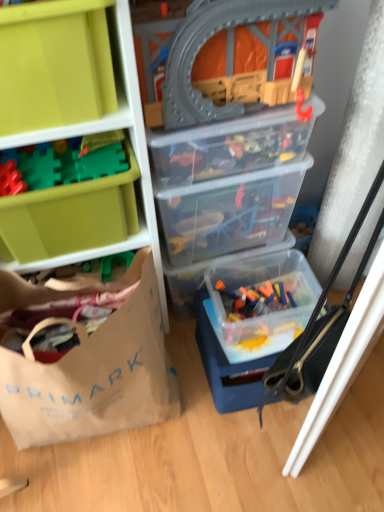
Question: Can you confirm if transparent plastic toy train set at center, the 3th storage box in the front-to-back sequence, is wider than translucent plastic container at center, which is the 1th storage box in back-to-front order?

Choices:
 (A) yes
 (B) no

Answer: (B)

Question: From a real-world perspective, is transparent plastic toy train set at center, the 3th storage box in the front-to-back sequence, positioned under translucent plastic container at center, which is the 1th storage box in back-to-front order, based on gravity?

Choices:
 (A) no
 (B) yes

Answer: (A)

Question: From the image's perspective, does transparent plastic toy train set at center, the 3th storage box in the front-to-back sequence, appear lower than translucent plastic container at center, acting as the sixth storage box starting from the front?

Choices:
 (A) yes
 (B) no

Answer: (B)

Question: From a real-world perspective, is transparent plastic toy train set at center, the 3th storage box in the front-to-back sequence, over translucent plastic container at center, which is the 1th storage box in back-to-front order?

Choices:
 (A) no
 (B) yes

Answer: (B)

Question: Is the depth of transparent plastic toy train set at center, the 3th storage box in the front-to-back sequence, greater than that of translucent plastic container at center, acting as the sixth storage box starting from the front?

Choices:
 (A) yes
 (B) no

Answer: (B)

Question: Based on their positions, is translucent plastic container at lower right, which is the first toy from bottom to top, located to the left or right of transparent plastic toy train set at center, the 3th storage box in the front-to-back sequence?

Choices:
 (A) left
 (B) right

Answer: (B)

Question: Is point (274, 308) closer or farther from the camera than point (274, 128)?

Choices:
 (A) farther
 (B) closer

Answer: (A)

Question: From a real-world perspective, is translucent plastic container at lower right, the third toy positioned from the left, physically located above or below transparent plastic toy train set at center, the 3th storage box in the front-to-back sequence?

Choices:
 (A) below
 (B) above

Answer: (A)

Question: Choose the correct answer: Is translucent plastic container at lower right, which is the first toy in back-to-front order, inside transparent plastic toy train set at center, the 3th storage box in the front-to-back sequence, or outside it?

Choices:
 (A) inside
 (B) outside

Answer: (B)

Question: In terms of height, does matte green plastic storage box at upper left, the sixth storage box positioned from the back, look taller or shorter compared to transparent plastic train set at upper center, which is the first toy in front-to-back order?

Choices:
 (A) tall
 (B) short

Answer: (B)

Question: Based on their sizes in the image, would you say matte green plastic storage box at upper left, the sixth storage box positioned from the back, is bigger or smaller than transparent plastic train set at upper center, which is the 1th toy from top to bottom?

Choices:
 (A) big
 (B) small

Answer: (B)

Question: Does point (38, 88) appear closer or farther from the camera than point (264, 75)?

Choices:
 (A) closer
 (B) farther

Answer: (A)

Question: From a real-world perspective, is matte green plastic storage box at upper left, the sixth storage box positioned from the back, positioned above or below transparent plastic train set at upper center, positioned as the 2th toy in left-to-right order?

Choices:
 (A) above
 (B) below

Answer: (A)

Question: Considering their positions, is green plastic blocks at upper left, the second toy positioned from the front, located in front of or behind brown paper bag at lower left?

Choices:
 (A) behind
 (B) front

Answer: (A)

Question: Based on their sizes in the image, would you say green plastic blocks at upper left, the 3th toy positioned from the right, is bigger or smaller than brown paper bag at lower left?

Choices:
 (A) small
 (B) big

Answer: (A)